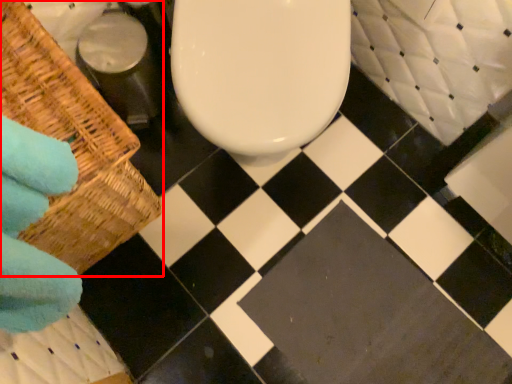
Question: From the image's perspective, what is the correct spatial positioning of basket (annotated by the red box) in reference to square?

Choices:
 (A) below
 (B) above

Answer: (B)